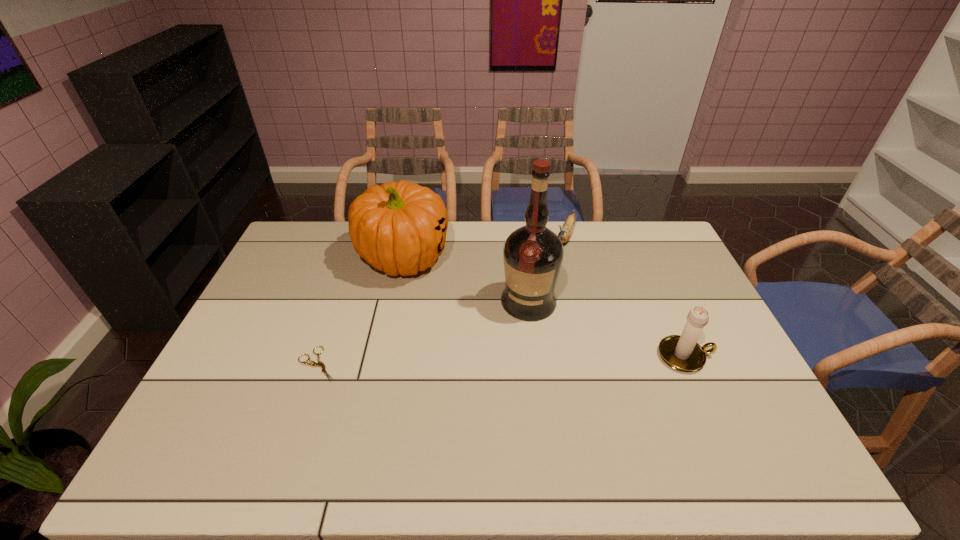
At what (x,y) coordinates should I click in order to perform the action: click on free space between the shears and the liquor. Please return your answer as a coordinate pair (x, y). Looking at the image, I should click on (423, 333).

The image size is (960, 540). Identify the location of vacant area that lies between the banana and the pumpkin. (484, 247).

Identify the location of free point between the third object from right to left and the candle holder. The width and height of the screenshot is (960, 540). (607, 329).

Find the location of a particular element. free spot between the second tallest object and the second shortest object is located at coordinates (484, 247).

You are a GUI agent. You are given a task and a screenshot of the screen. Output one action in this format:
    pyautogui.click(x=<x>, y=<y>)
    Task: Click on the vacant area that lies between the shears and the fourth object from left to right
    Image resolution: width=960 pixels, height=540 pixels.
    Given the screenshot: What is the action you would take?
    pyautogui.click(x=442, y=300)

I want to click on free space between the fourth tallest object and the second tallest object, so click(484, 247).

The width and height of the screenshot is (960, 540). In order to click on vacant region between the banana and the shortest object in this screenshot , I will do `click(442, 300)`.

The height and width of the screenshot is (540, 960). Find the location of `object that stands as the second closest to the third object from left to right`. object that stands as the second closest to the third object from left to right is located at coordinates (565, 234).

You are a GUI agent. You are given a task and a screenshot of the screen. Output one action in this format:
    pyautogui.click(x=<x>, y=<y>)
    Task: Click on the object that is the second closest to the banana
    The width and height of the screenshot is (960, 540).
    Given the screenshot: What is the action you would take?
    pyautogui.click(x=400, y=227)

Locate an element on the screen. This screenshot has width=960, height=540. free location that satisfies the following two spatial constraints: 1. on the back side of the second shortest object; 2. on the right side of the shortest object is located at coordinates (362, 236).